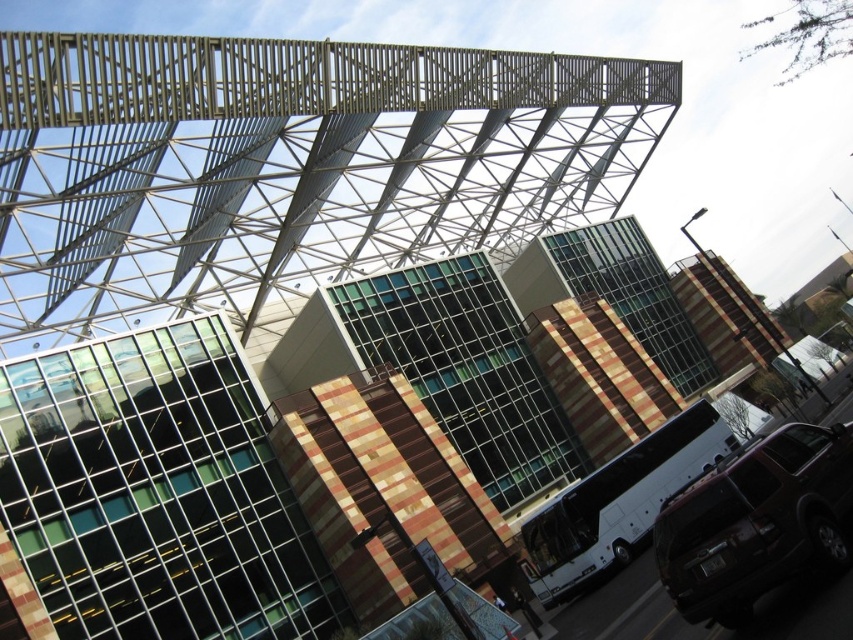
Between point (697, 616) and point (650, 516), which one is positioned behind?

The point (650, 516) is behind.

Is shiny black suv at lower right below white metallic bus at center?

Incorrect, shiny black suv at lower right is not positioned below white metallic bus at center.

Between point (717, 544) and point (556, 524), which one is positioned behind?

Positioned behind is point (556, 524).

Locate an element on the screen. The height and width of the screenshot is (640, 853). shiny black suv at lower right is located at coordinates (756, 522).